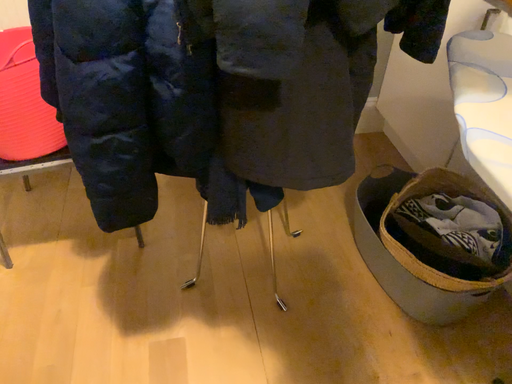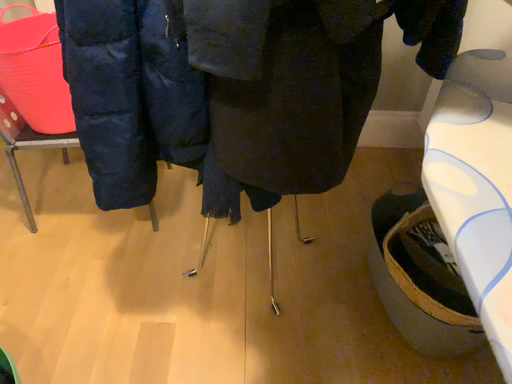
Question: Which way did the camera rotate in the video?

Choices:
 (A) rotated left
 (B) rotated right

Answer: (A)